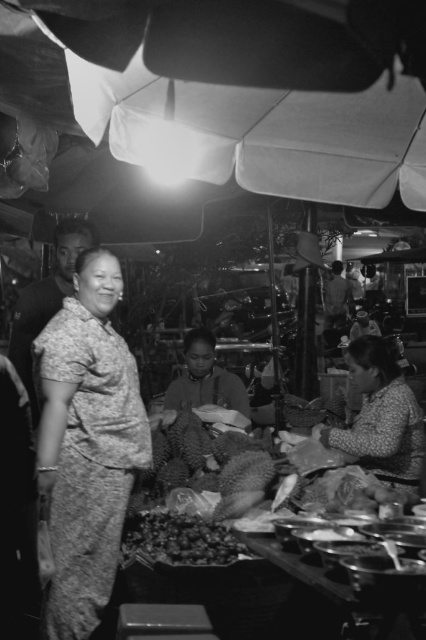
Question: Is dotted fabric dress at left to the left of floral-patterned fabric at lower right from the viewer's perspective?

Choices:
 (A) yes
 (B) no

Answer: (A)

Question: Is dotted fabric dress at left above floral-patterned fabric at lower right?

Choices:
 (A) yes
 (B) no

Answer: (A)

Question: Which of the following is the farthest from the observer?

Choices:
 (A) floral-patterned fabric at lower right
 (B) dotted fabric dress at left

Answer: (A)

Question: Does dotted fabric dress at left appear on the right side of floral-patterned fabric at lower right?

Choices:
 (A) no
 (B) yes

Answer: (A)